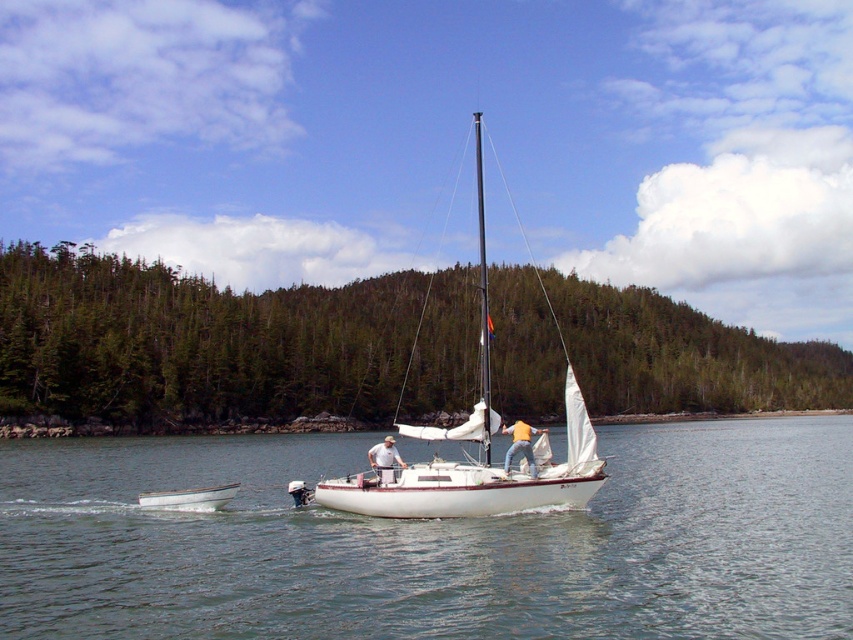
Question: Where is black polished mast at center located in relation to white fabric sailboat at center in the image?

Choices:
 (A) above
 (B) below

Answer: (A)

Question: Which of the following is the closest to the observer?

Choices:
 (A) (537, 269)
 (B) (525, 588)
 (C) (531, 442)
 (D) (477, 173)

Answer: (B)

Question: In this image, where is white matte sailboat at center located relative to yellow cotton shirt at center?

Choices:
 (A) below
 (B) above

Answer: (B)

Question: In this image, where is yellow cotton shirt at center located relative to white fabric sailboat at center?

Choices:
 (A) above
 (B) below

Answer: (B)

Question: Which point is closer to the camera taking this photo?

Choices:
 (A) (393, 456)
 (B) (401, 481)
 (C) (155, 493)
 (D) (477, 163)

Answer: (B)

Question: Considering the real-world distances, which object is farthest from the black polished mast at center?

Choices:
 (A) white fabric sailboat at center
 (B) yellow cotton shirt at center
 (C) clear water at center

Answer: (A)